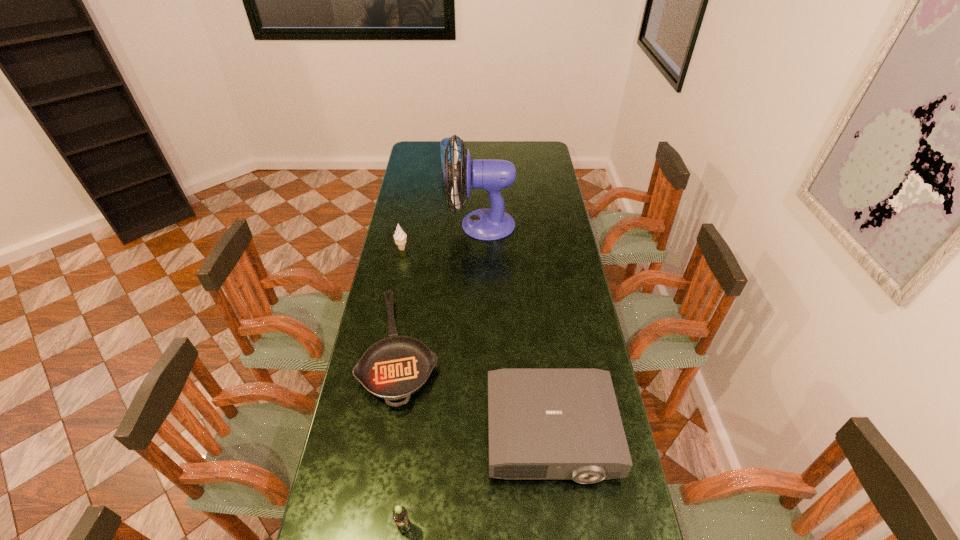
The width and height of the screenshot is (960, 540). Identify the location of vacant space that is in between the projector and the mug. (502, 301).

Find the location of a particular element. The image size is (960, 540). free space that is in between the fifth shortest object and the projector is located at coordinates (502, 301).

Where is `blank region between the fan and the projector`? The height and width of the screenshot is (540, 960). blank region between the fan and the projector is located at coordinates 516,329.

At what (x,y) coordinates should I click in order to perform the action: click on object that can be found as the closest to the mug. Please return your answer as a coordinate pair (x, y). This screenshot has height=540, width=960. Looking at the image, I should click on (492, 175).

You are a GUI agent. You are given a task and a screenshot of the screen. Output one action in this format:
    pyautogui.click(x=<x>, y=<y>)
    Task: Click on the object that is the fifth nearest to the farthest object
    
    Given the screenshot: What is the action you would take?
    pyautogui.click(x=400, y=515)

Identify the location of vacant space that satisfies the following two spatial constraints: 1. on the front-facing side of the frying pan; 2. on the left side of the icecream. (382, 348).